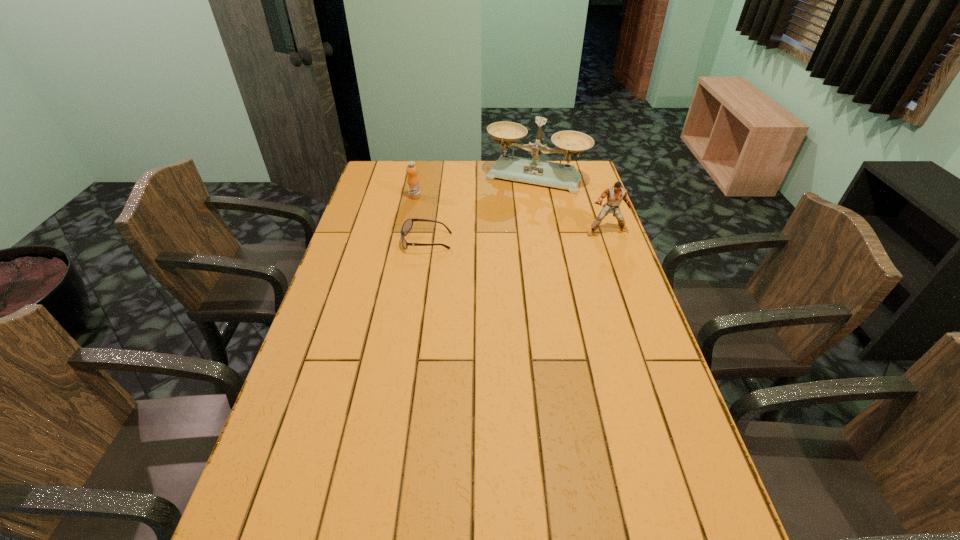
Find the location of a particular element. free space on the desktop that is between the sunglasses and the puncher and is positioned on the front-facing side of the tallest object is located at coordinates pyautogui.click(x=508, y=237).

Find the location of a particular element. The width and height of the screenshot is (960, 540). vacant spot on the desktop that is between the sunglasses and the third shortest object and is positioned on the front label of the third tallest object is located at coordinates (541, 234).